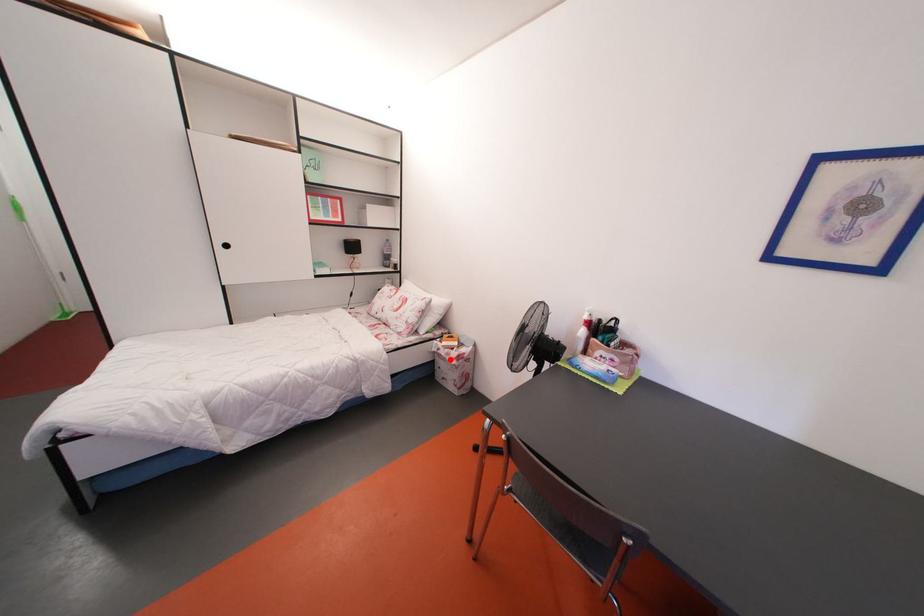
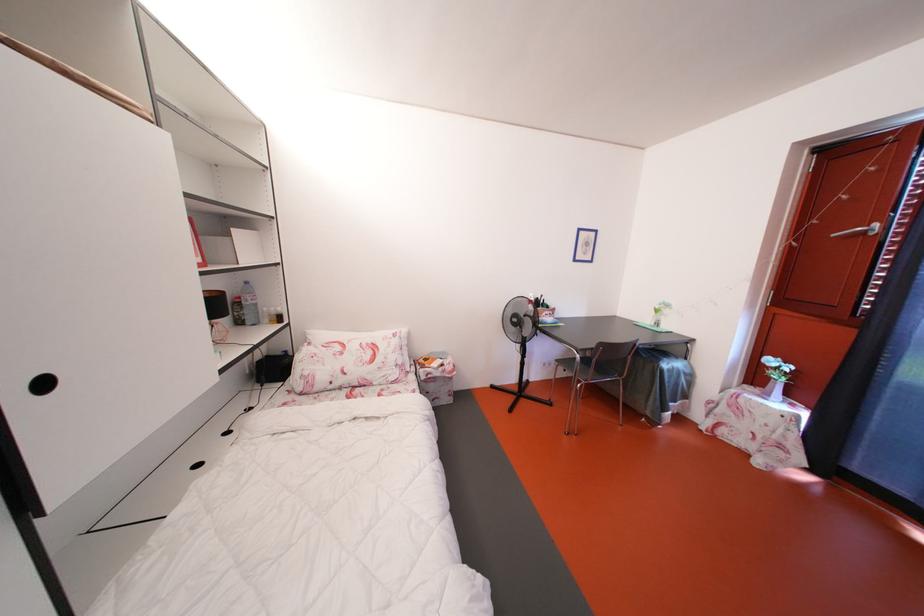
In the second image, find the point that corresponds to the highlighted location in the first image.

(444, 379)